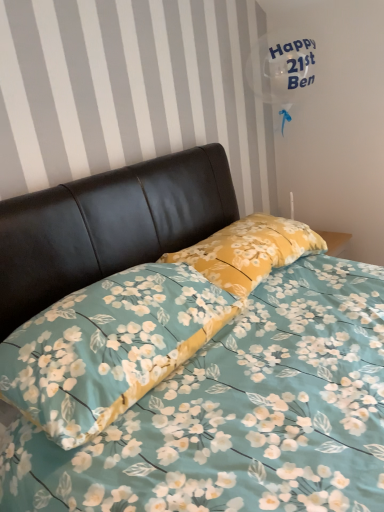
Where is `yellow floral pillow at center, the 2th pillow from the front`? This screenshot has height=512, width=384. yellow floral pillow at center, the 2th pillow from the front is located at coordinates (248, 251).

What do you see at coordinates (248, 251) in the screenshot? This screenshot has height=512, width=384. I see `yellow floral pillow at center, the 2th pillow from the front` at bounding box center [248, 251].

What are the coordinates of `floral fabric pillow at center, arranged as the 1th pillow when viewed from the front` in the screenshot? It's located at (108, 347).

This screenshot has height=512, width=384. What do you see at coordinates (108, 347) in the screenshot?
I see `floral fabric pillow at center, positioned as the second pillow in back-to-front order` at bounding box center [108, 347].

How much space does floral fabric pillow at center, arranged as the 1th pillow when viewed from the front, occupy horizontally?

19.11 inches.

Where is `yellow floral pillow at center, which appears as the 1th pillow when viewed from the back`? yellow floral pillow at center, which appears as the 1th pillow when viewed from the back is located at coordinates (248, 251).

Does yellow floral pillow at center, the 2th pillow from the front, appear on the left side of floral fabric pillow at center, arranged as the 1th pillow when viewed from the front?

No, yellow floral pillow at center, the 2th pillow from the front, is not to the left of floral fabric pillow at center, arranged as the 1th pillow when viewed from the front.

Which object is closer to the camera taking this photo, yellow floral pillow at center, the 2th pillow from the front, or floral fabric pillow at center, arranged as the 1th pillow when viewed from the front?

floral fabric pillow at center, arranged as the 1th pillow when viewed from the front, is more forward.

Is point (228, 248) farther from camera compared to point (75, 343)?

Yes, it is.

From the image's perspective, is yellow floral pillow at center, which appears as the 1th pillow when viewed from the back, above or below floral fabric pillow at center, positioned as the second pillow in back-to-front order?

yellow floral pillow at center, which appears as the 1th pillow when viewed from the back, is above floral fabric pillow at center, positioned as the second pillow in back-to-front order.

From a real-world perspective, which object stands above the other?

yellow floral pillow at center, which appears as the 1th pillow when viewed from the back, from a real-world perspective.

Which of these two, yellow floral pillow at center, the 2th pillow from the front, or floral fabric pillow at center, arranged as the 1th pillow when viewed from the front, is wider?

Wider between the two is floral fabric pillow at center, arranged as the 1th pillow when viewed from the front.

Considering the sizes of objects yellow floral pillow at center, which appears as the 1th pillow when viewed from the back, and floral fabric pillow at center, positioned as the second pillow in back-to-front order, in the image provided, who is taller, yellow floral pillow at center, which appears as the 1th pillow when viewed from the back, or floral fabric pillow at center, positioned as the second pillow in back-to-front order,?

With more height is floral fabric pillow at center, positioned as the second pillow in back-to-front order.

Based on their sizes in the image, would you say yellow floral pillow at center, which appears as the 1th pillow when viewed from the back, is bigger or smaller than floral fabric pillow at center, positioned as the second pillow in back-to-front order?

yellow floral pillow at center, which appears as the 1th pillow when viewed from the back, is smaller than floral fabric pillow at center, positioned as the second pillow in back-to-front order.

Is floral fabric pillow at center, arranged as the 1th pillow when viewed from the front, a part of yellow floral pillow at center, the 2th pillow from the front?

No, floral fabric pillow at center, arranged as the 1th pillow when viewed from the front, is not inside yellow floral pillow at center, the 2th pillow from the front.

Is the surface of yellow floral pillow at center, the 2th pillow from the front, in direct contact with floral fabric pillow at center, arranged as the 1th pillow when viewed from the front?

There is a gap between yellow floral pillow at center, the 2th pillow from the front, and floral fabric pillow at center, arranged as the 1th pillow when viewed from the front.

Could you tell me if yellow floral pillow at center, the 2th pillow from the front, is turned towards floral fabric pillow at center, positioned as the second pillow in back-to-front order?

No, yellow floral pillow at center, the 2th pillow from the front, is not oriented towards floral fabric pillow at center, positioned as the second pillow in back-to-front order.

Find the location of a particular element. pillow that is above the floral fabric pillow at center, arranged as the 1th pillow when viewed from the front (from a real-world perspective) is located at coordinates (248, 251).

Visually, is floral fabric pillow at center, positioned as the second pillow in back-to-front order, positioned to the left or to the right of yellow floral pillow at center, the 2th pillow from the front?

Clearly, floral fabric pillow at center, positioned as the second pillow in back-to-front order, is on the left of yellow floral pillow at center, the 2th pillow from the front, in the image.

Who is more distant, floral fabric pillow at center, arranged as the 1th pillow when viewed from the front, or yellow floral pillow at center, the 2th pillow from the front?

yellow floral pillow at center, the 2th pillow from the front, is further from the camera.

Does point (15, 383) come behind point (295, 239)?

No.

From the image's perspective, is floral fabric pillow at center, positioned as the second pillow in back-to-front order, under yellow floral pillow at center, the 2th pillow from the front?

Correct, floral fabric pillow at center, positioned as the second pillow in back-to-front order, appears lower than yellow floral pillow at center, the 2th pillow from the front, in the image.

Consider the image. From a real-world perspective, is floral fabric pillow at center, positioned as the second pillow in back-to-front order, located beneath yellow floral pillow at center, which appears as the 1th pillow when viewed from the back?

Yes, from a real-world perspective, floral fabric pillow at center, positioned as the second pillow in back-to-front order, is beneath yellow floral pillow at center, which appears as the 1th pillow when viewed from the back.

Is floral fabric pillow at center, positioned as the second pillow in back-to-front order, thinner than yellow floral pillow at center, the 2th pillow from the front?

No, floral fabric pillow at center, positioned as the second pillow in back-to-front order, is not thinner than yellow floral pillow at center, the 2th pillow from the front.

Considering the sizes of objects floral fabric pillow at center, arranged as the 1th pillow when viewed from the front, and yellow floral pillow at center, the 2th pillow from the front, in the image provided, who is taller, floral fabric pillow at center, arranged as the 1th pillow when viewed from the front, or yellow floral pillow at center, the 2th pillow from the front,?

With more height is floral fabric pillow at center, arranged as the 1th pillow when viewed from the front.

Between floral fabric pillow at center, arranged as the 1th pillow when viewed from the front, and yellow floral pillow at center, which appears as the 1th pillow when viewed from the back, which one has smaller size?

Smaller between the two is yellow floral pillow at center, which appears as the 1th pillow when viewed from the back.

Would you say floral fabric pillow at center, positioned as the second pillow in back-to-front order, contains yellow floral pillow at center, the 2th pillow from the front?

No, yellow floral pillow at center, the 2th pillow from the front, is not a part of floral fabric pillow at center, positioned as the second pillow in back-to-front order.

Looking at this image, is floral fabric pillow at center, arranged as the 1th pillow when viewed from the front, positioned far away from yellow floral pillow at center, the 2th pillow from the front?

No, floral fabric pillow at center, arranged as the 1th pillow when viewed from the front, is not far away from yellow floral pillow at center, the 2th pillow from the front.

Based on the photo, is floral fabric pillow at center, arranged as the 1th pillow when viewed from the front, oriented away from yellow floral pillow at center, the 2th pillow from the front?

floral fabric pillow at center, arranged as the 1th pillow when viewed from the front, is not turned away from yellow floral pillow at center, the 2th pillow from the front.

This screenshot has height=512, width=384. I want to click on pillow on the left side of yellow floral pillow at center, which appears as the 1th pillow when viewed from the back, so [108, 347].

What are the coordinates of `pillow below the yellow floral pillow at center, which appears as the 1th pillow when viewed from the back (from the image's perspective)` in the screenshot? It's located at (108, 347).

The width and height of the screenshot is (384, 512). Identify the location of pillow in front of the yellow floral pillow at center, which appears as the 1th pillow when viewed from the back. (108, 347).